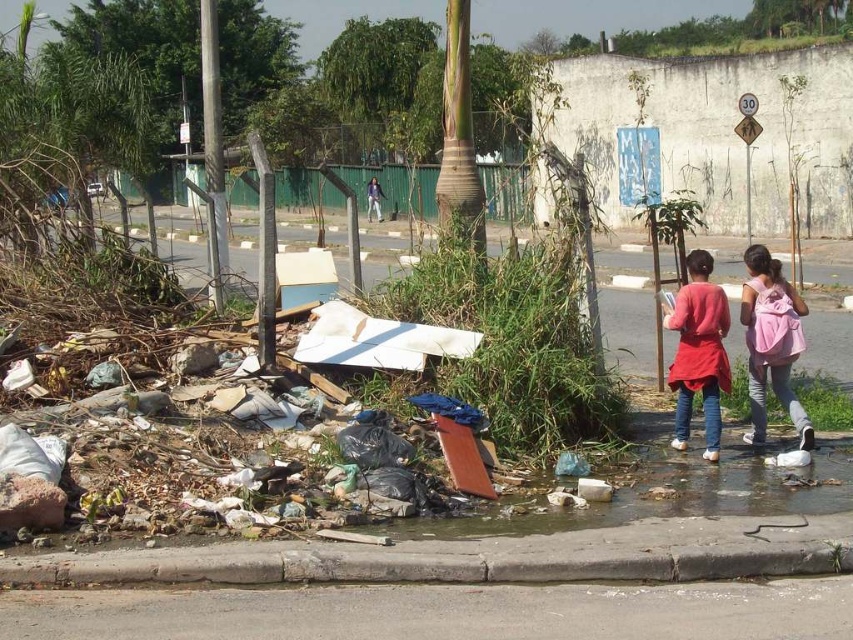
You are a delivery person trying to navigate through the debris on the road. You see the gray concrete curb at lower center and the pink fabric carrier at right. Which object takes up more space in the image?

The pink fabric carrier at right occupies more space than the gray concrete curb at lower center according to the description.

You are a delivery person trying to decide which item to use to carry groceries. The pink fabric carrier at right and the purple fabric at center are both available. Based on their sizes, which one can hold more items?

The purple fabric at center can hold more items because it is larger than the pink fabric carrier at right.

You are standing at the point marked by coordinates point (419,564) in the image. Looking around, you see the gray concrete curb at lower center. What is the nearest object to you in the scene?

The gray concrete curb at lower center is located at point (419,564), so the nearest object to you is the gray concrete curb at lower center itself since you are standing on it.